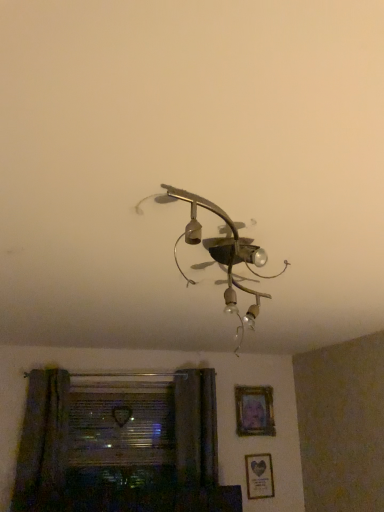
Question: Considering the relative sizes of matte gold picture frame at lower right, positioned as the 2th picture frame in top-to-bottom order, and transparent glass window at lower left in the image provided, is matte gold picture frame at lower right, positioned as the 2th picture frame in top-to-bottom order, shorter than transparent glass window at lower left?

Choices:
 (A) no
 (B) yes

Answer: (B)

Question: Is matte gold picture frame at lower right, the first picture frame when ordered from bottom to top, far away from transparent glass window at lower left?

Choices:
 (A) no
 (B) yes

Answer: (A)

Question: From a real-world perspective, is matte gold picture frame at lower right, the first picture frame when ordered from bottom to top, over transparent glass window at lower left?

Choices:
 (A) yes
 (B) no

Answer: (B)

Question: Considering the relative sizes of matte gold picture frame at lower right, the first picture frame when ordered from bottom to top, and transparent glass window at lower left in the image provided, is matte gold picture frame at lower right, the first picture frame when ordered from bottom to top, smaller than transparent glass window at lower left?

Choices:
 (A) yes
 (B) no

Answer: (A)

Question: Is the depth of matte gold picture frame at lower right, the first picture frame when ordered from bottom to top, less than that of transparent glass window at lower left?

Choices:
 (A) no
 (B) yes

Answer: (A)

Question: Could you tell me if matte gold picture frame at lower right, positioned as the 2th picture frame in top-to-bottom order, is facing transparent glass window at lower left?

Choices:
 (A) yes
 (B) no

Answer: (B)

Question: Is green fabric curtain at lower left turned away from matte gold picture frame at lower right, positioned as the 2th picture frame in top-to-bottom order?

Choices:
 (A) yes
 (B) no

Answer: (B)

Question: Is green fabric curtain at lower left aimed at matte gold picture frame at lower right, the first picture frame when ordered from bottom to top?

Choices:
 (A) no
 (B) yes

Answer: (A)

Question: Can you confirm if green fabric curtain at lower left is taller than matte gold picture frame at lower right, positioned as the 2th picture frame in top-to-bottom order?

Choices:
 (A) yes
 (B) no

Answer: (A)

Question: Does green fabric curtain at lower left have a smaller size compared to matte gold picture frame at lower right, the first picture frame when ordered from bottom to top?

Choices:
 (A) no
 (B) yes

Answer: (A)

Question: From the image's perspective, is green fabric curtain at lower left on top of matte gold picture frame at lower right, positioned as the 2th picture frame in top-to-bottom order?

Choices:
 (A) no
 (B) yes

Answer: (B)

Question: Is green fabric curtain at lower left to the right of matte gold picture frame at lower right, the first picture frame when ordered from bottom to top, from the viewer's perspective?

Choices:
 (A) no
 (B) yes

Answer: (A)

Question: From a real-world perspective, is green fabric curtain at lower left over wooden frame at upper center, positioned as the 1th picture frame in top-to-bottom order?

Choices:
 (A) yes
 (B) no

Answer: (B)